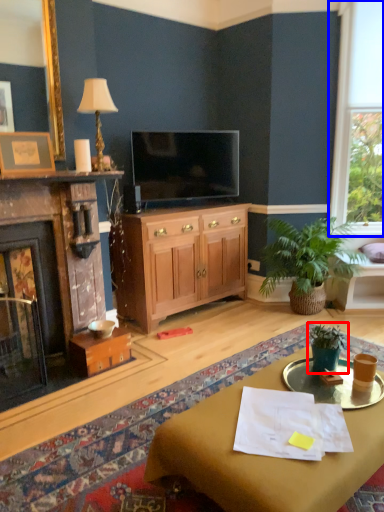
Question: Which of the following is the closest to the observer, houseplant (highlighted by a red box) or window (highlighted by a blue box)?

Choices:
 (A) houseplant
 (B) window

Answer: (A)